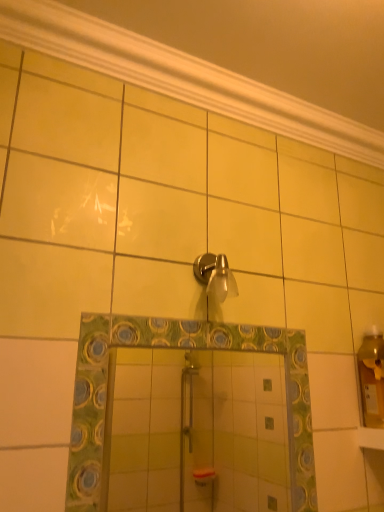
Question: From the image's perspective, is white glossy molding at upper center beneath green mosaic mirror at center?

Choices:
 (A) no
 (B) yes

Answer: (A)

Question: Does white glossy molding at upper center come in front of green mosaic mirror at center?

Choices:
 (A) no
 (B) yes

Answer: (A)

Question: From a real-world perspective, is white glossy molding at upper center beneath green mosaic mirror at center?

Choices:
 (A) no
 (B) yes

Answer: (A)

Question: Is white glossy molding at upper center taller than green mosaic mirror at center?

Choices:
 (A) no
 (B) yes

Answer: (A)

Question: Is white glossy molding at upper center thinner than green mosaic mirror at center?

Choices:
 (A) no
 (B) yes

Answer: (A)

Question: Is white glossy molding at upper center facing away from green mosaic mirror at center?

Choices:
 (A) no
 (B) yes

Answer: (A)

Question: Does green mosaic mirror at center contain white glossy molding at upper center?

Choices:
 (A) no
 (B) yes

Answer: (A)

Question: Does green mosaic mirror at center touch white glossy molding at upper center?

Choices:
 (A) no
 (B) yes

Answer: (A)

Question: From the image's perspective, would you say green mosaic mirror at center is positioned over white glossy molding at upper center?

Choices:
 (A) no
 (B) yes

Answer: (A)

Question: Is green mosaic mirror at center not within white glossy molding at upper center?

Choices:
 (A) yes
 (B) no

Answer: (A)

Question: Is green mosaic mirror at center smaller than white glossy molding at upper center?

Choices:
 (A) no
 (B) yes

Answer: (A)

Question: Does green mosaic mirror at center turn towards white glossy molding at upper center?

Choices:
 (A) no
 (B) yes

Answer: (A)

Question: Is satin nickel shower head at upper center smaller than green mosaic mirror at center?

Choices:
 (A) no
 (B) yes

Answer: (B)